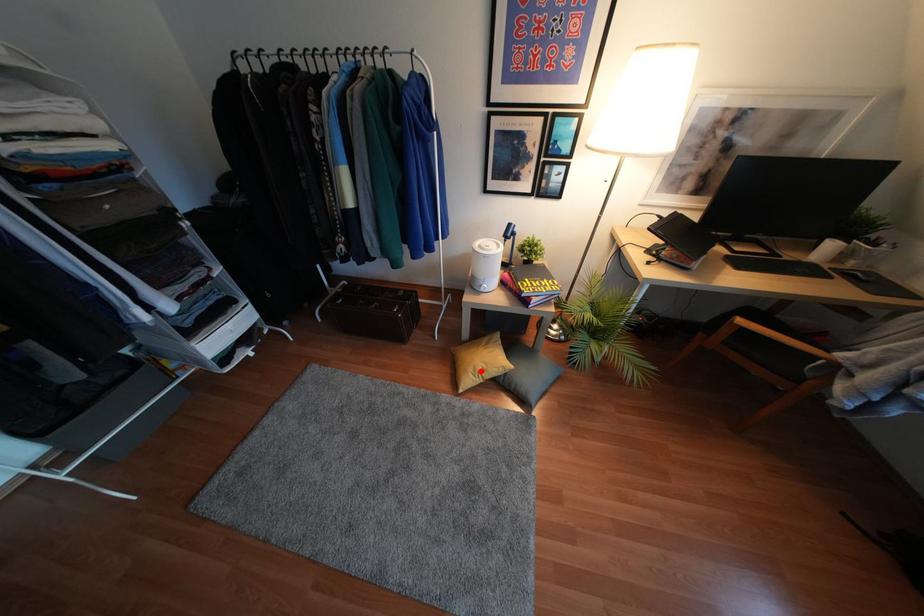
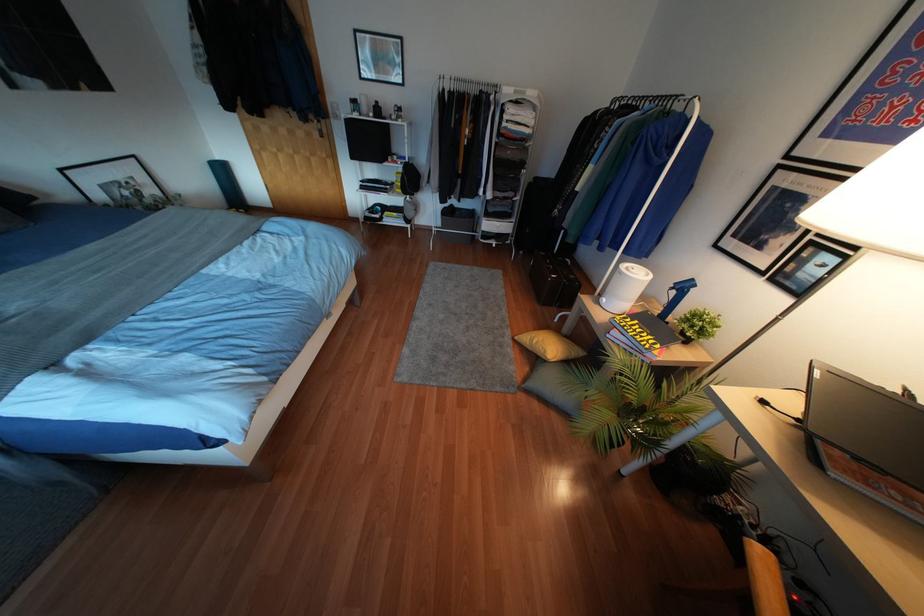
In the second image, find the point that corresponds to the highlighted location in the first image.

(533, 341)